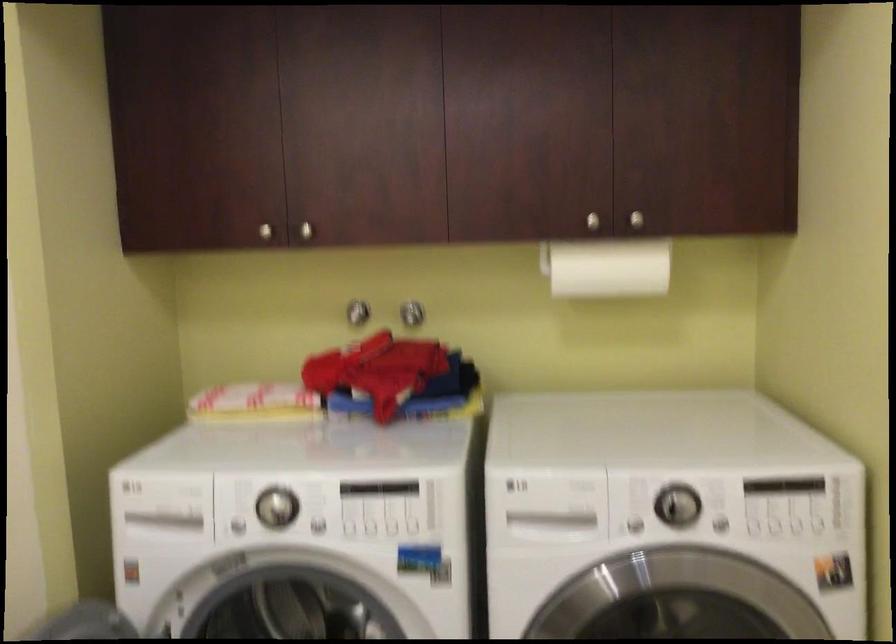
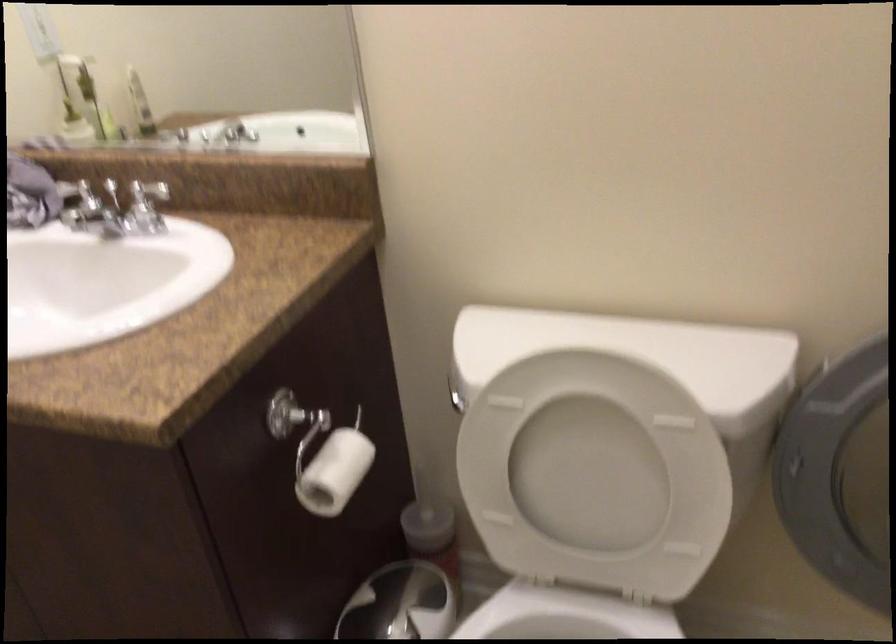
Based on the continuous images, in which direction is the camera rotating?

The camera's rotation is toward left-down.